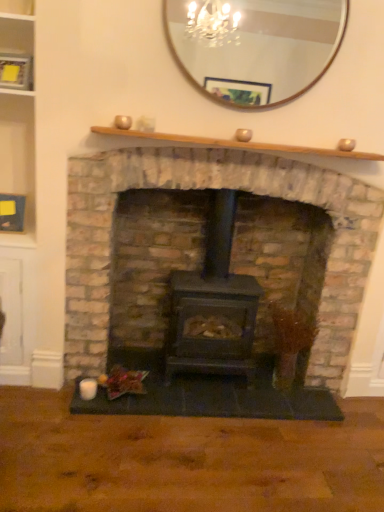
Question: Should I look upward or downward to see wooden shelf at upper center?

Choices:
 (A) down
 (B) up

Answer: (B)

Question: Considering the relative sizes of matte black wood stove at center and black matte wood burning stove at center in the image provided, is matte black wood stove at center shorter than black matte wood burning stove at center?

Choices:
 (A) yes
 (B) no

Answer: (B)

Question: From the image's perspective, would you say matte black wood stove at center is shown under black matte wood burning stove at center?

Choices:
 (A) yes
 (B) no

Answer: (B)

Question: Considering the relative sizes of matte black wood stove at center and black matte wood burning stove at center in the image provided, is matte black wood stove at center smaller than black matte wood burning stove at center?

Choices:
 (A) no
 (B) yes

Answer: (A)

Question: Can you confirm if matte black wood stove at center is wider than black matte wood burning stove at center?

Choices:
 (A) no
 (B) yes

Answer: (B)

Question: Considering the relative sizes of matte black wood stove at center and black matte wood burning stove at center in the image provided, is matte black wood stove at center taller than black matte wood burning stove at center?

Choices:
 (A) yes
 (B) no

Answer: (A)

Question: Is matte black wood stove at center bigger than black matte wood burning stove at center?

Choices:
 (A) no
 (B) yes

Answer: (B)

Question: Is wooden shelf at upper center facing towards black matte wood burning stove at center?

Choices:
 (A) yes
 (B) no

Answer: (B)

Question: Is black matte wood burning stove at center a part of wooden shelf at upper center?

Choices:
 (A) yes
 (B) no

Answer: (B)

Question: From a real-world perspective, is wooden shelf at upper center under black matte wood burning stove at center?

Choices:
 (A) yes
 (B) no

Answer: (B)

Question: Can you confirm if wooden shelf at upper center is positioned to the right of black matte wood burning stove at center?

Choices:
 (A) no
 (B) yes

Answer: (B)

Question: From a real-world perspective, is wooden shelf at upper center positioned over black matte wood burning stove at center based on gravity?

Choices:
 (A) no
 (B) yes

Answer: (B)

Question: From the image's perspective, is wooden shelf at upper center under black matte wood burning stove at center?

Choices:
 (A) yes
 (B) no

Answer: (B)

Question: Considering the relative positions of wooden mirror at upper center and matte black wood stove at center in the image provided, is wooden mirror at upper center to the left of matte black wood stove at center from the viewer's perspective?

Choices:
 (A) no
 (B) yes

Answer: (A)